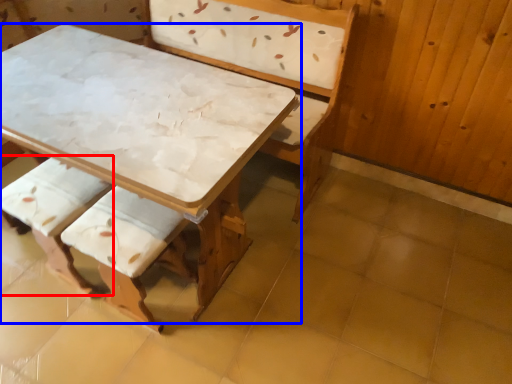
Question: Which of the following is the farthest to the observer, armchair (highlighted by a red box) or table (highlighted by a blue box)?

Choices:
 (A) armchair
 (B) table

Answer: (A)